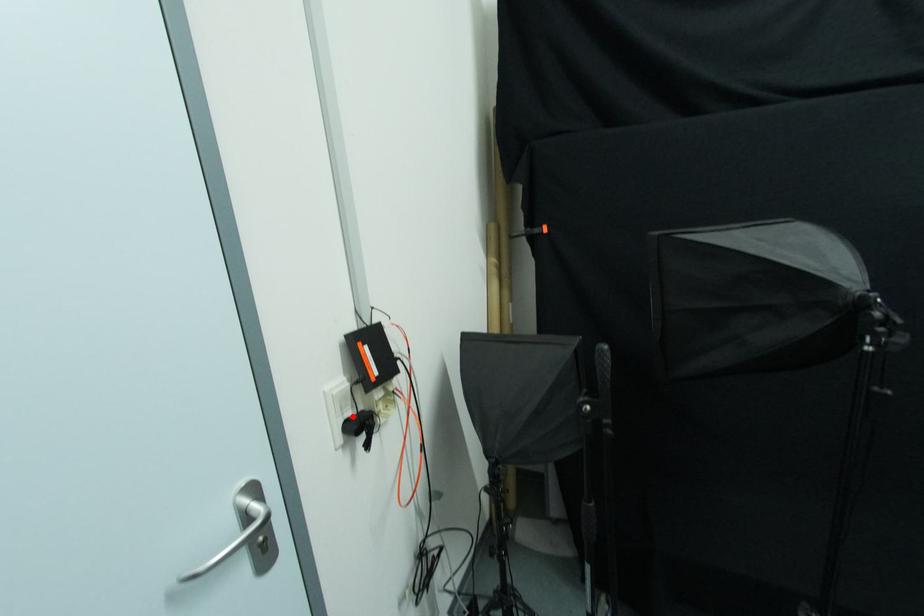
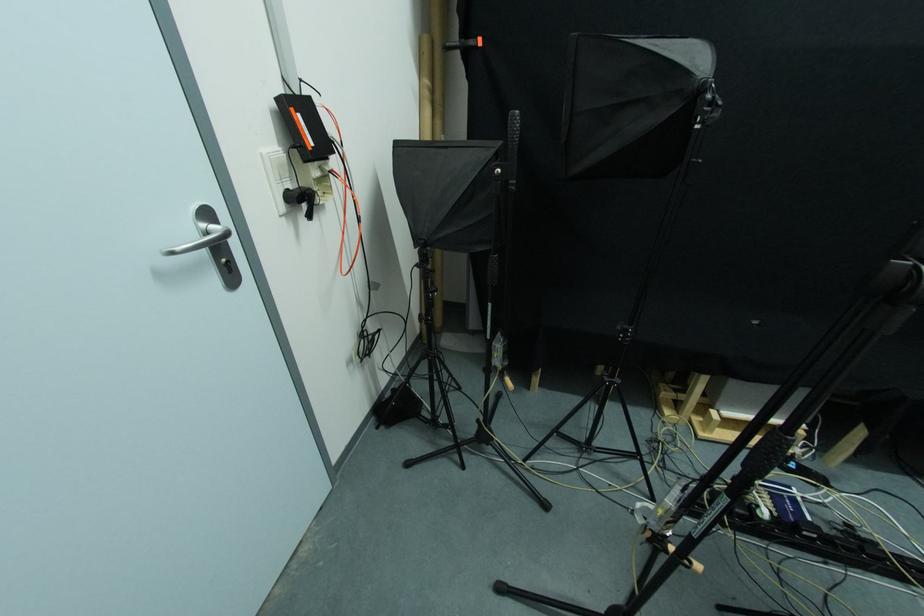
Locate, in the second image, the point that corresponds to the highlighted location in the first image.

(292, 188)